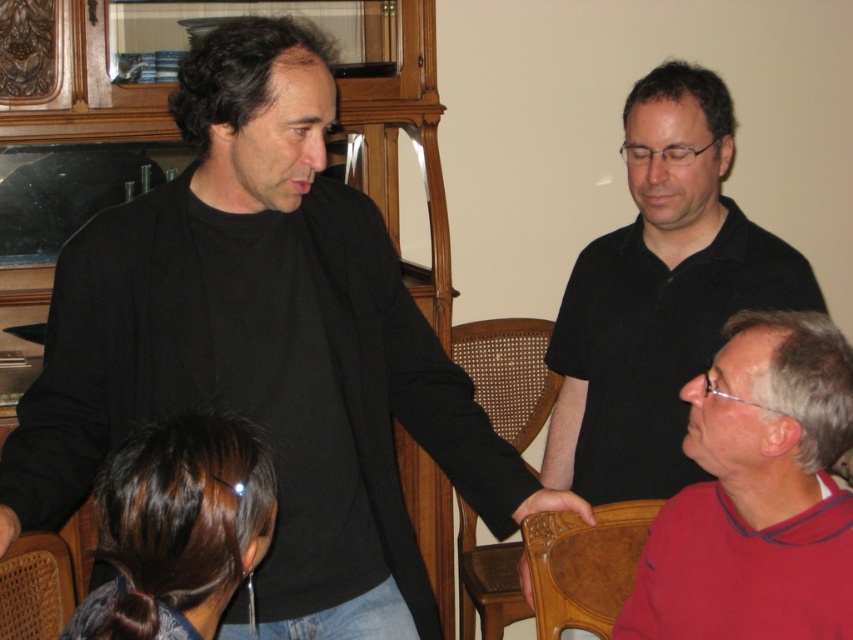
Which is below, red matte sweater at lower right or woven wood chair at center?

red matte sweater at lower right is lower down.

Between red matte sweater at lower right and woven wood chair at center, which one is positioned higher?

woven wood chair at center is above.

This screenshot has height=640, width=853. Describe the element at coordinates (756, 493) in the screenshot. I see `red matte sweater at lower right` at that location.

Where is `red matte sweater at lower right`? red matte sweater at lower right is located at coordinates (756, 493).

In order to click on black matte shirt at center in this screenshot , I will do `click(265, 348)`.

Who is higher up, red matte sweater at lower right or beech wood chair at lower center?

red matte sweater at lower right

Does point (636, 624) come farther from viewer compared to point (598, 538)?

No, it is in front of (598, 538).

What are the coordinates of `red matte sweater at lower right` in the screenshot? It's located at (756, 493).